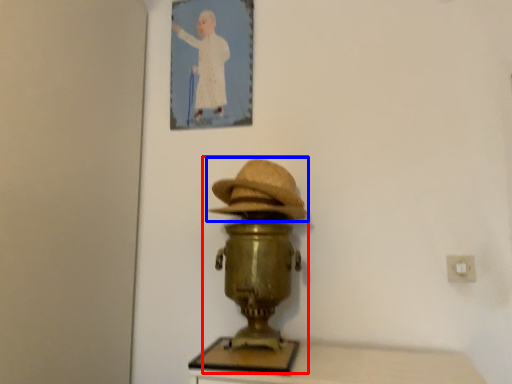
Question: Which object appears farthest to the camera in this image, table lamp (highlighted by a red box) or hat (highlighted by a blue box)?

Choices:
 (A) table lamp
 (B) hat

Answer: (B)